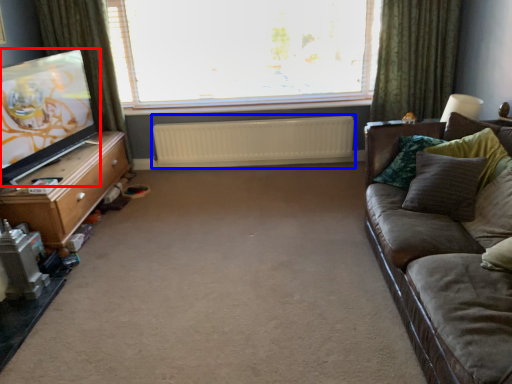
Question: Which object appears closest to the camera in this image, television (highlighted by a red box) or radiator (highlighted by a blue box)?

Choices:
 (A) television
 (B) radiator

Answer: (A)